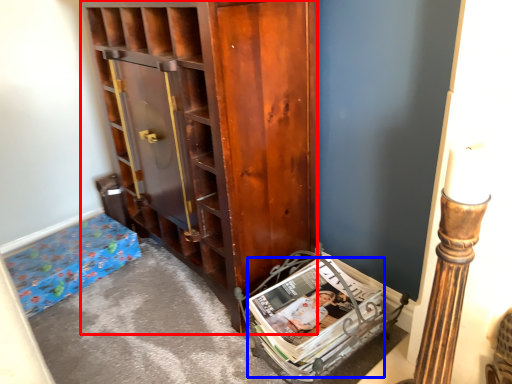
Question: Which object is closer to the camera taking this photo, cabinetry (highlighted by a red box) or magazine (highlighted by a blue box)?

Choices:
 (A) cabinetry
 (B) magazine

Answer: (A)